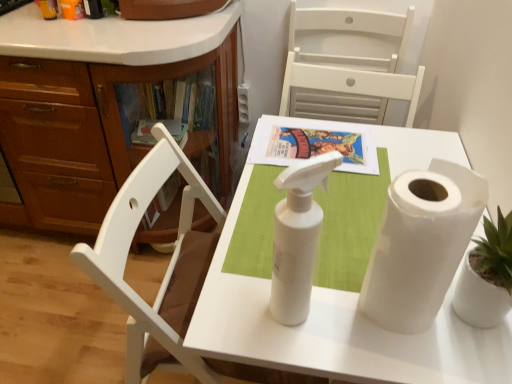
Question: Should I look upward or downward to see white paper at right?

Choices:
 (A) up
 (B) down

Answer: (B)

Question: From the image's perspective, is white paper at right over matte paper book at center?

Choices:
 (A) no
 (B) yes

Answer: (A)

Question: Is white paper at right next to matte paper book at center and touching it?

Choices:
 (A) no
 (B) yes

Answer: (A)

Question: Is white paper at right surrounding matte paper book at center?

Choices:
 (A) yes
 (B) no

Answer: (B)

Question: Can you confirm if white paper at right is wider than matte paper book at center?

Choices:
 (A) no
 (B) yes

Answer: (A)

Question: Is white paper at right further to the viewer compared to matte paper book at center?

Choices:
 (A) no
 (B) yes

Answer: (A)

Question: Is there a large distance between white paper at right and matte paper book at center?

Choices:
 (A) no
 (B) yes

Answer: (A)

Question: Is white paper at right not inside white matte paper towel roll at center?

Choices:
 (A) no
 (B) yes

Answer: (B)

Question: Can you confirm if white paper at right is positioned to the left of white matte paper towel roll at center?

Choices:
 (A) no
 (B) yes

Answer: (A)

Question: Considering the relative positions of white paper at right and white matte paper towel roll at center in the image provided, is white paper at right to the right of white matte paper towel roll at center from the viewer's perspective?

Choices:
 (A) yes
 (B) no

Answer: (A)

Question: Is white paper at right smaller than white matte paper towel roll at center?

Choices:
 (A) no
 (B) yes

Answer: (B)

Question: Is white paper at right further to camera compared to white matte paper towel roll at center?

Choices:
 (A) no
 (B) yes

Answer: (A)

Question: Does white paper at right turn towards white matte paper towel roll at center?

Choices:
 (A) yes
 (B) no

Answer: (B)

Question: Can you confirm if matte paper book at center is positioned to the left of white matte chair at upper center?

Choices:
 (A) yes
 (B) no

Answer: (A)